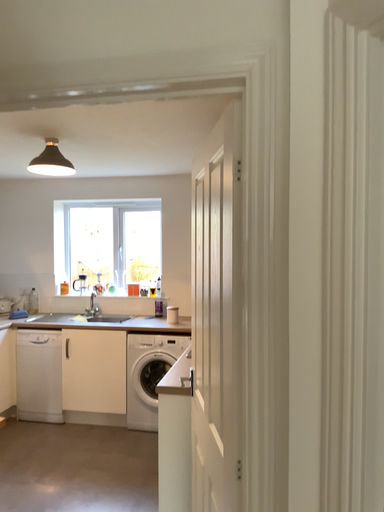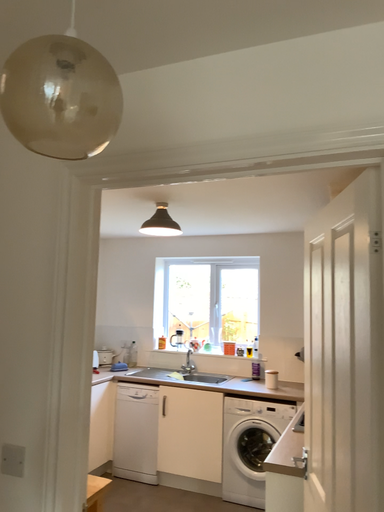
Question: How did the camera likely rotate when shooting the video?

Choices:
 (A) rotated downward
 (B) rotated upward

Answer: (B)